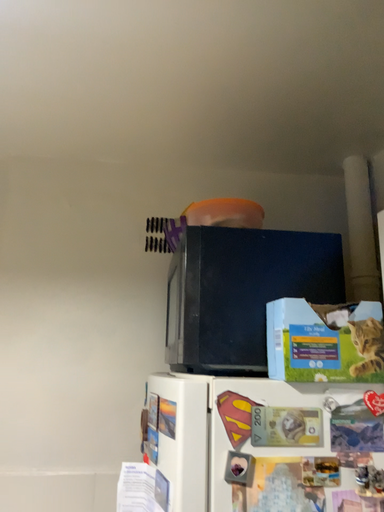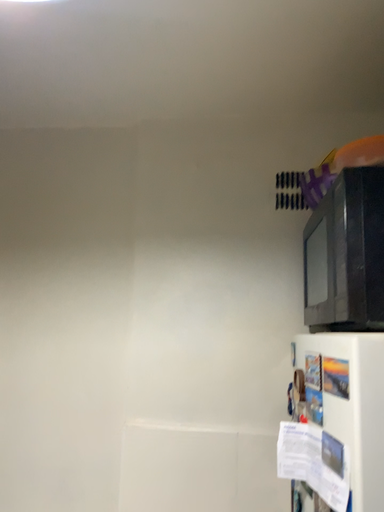
Question: How did the camera likely rotate when shooting the video?

Choices:
 (A) rotated left
 (B) rotated right

Answer: (A)